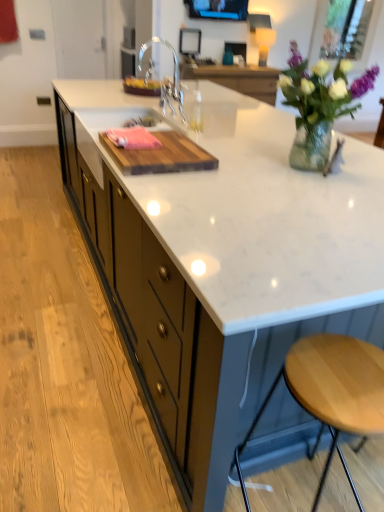
Where is `free point in front of clear glass vase at upper right`? This screenshot has width=384, height=512. free point in front of clear glass vase at upper right is located at coordinates (299, 200).